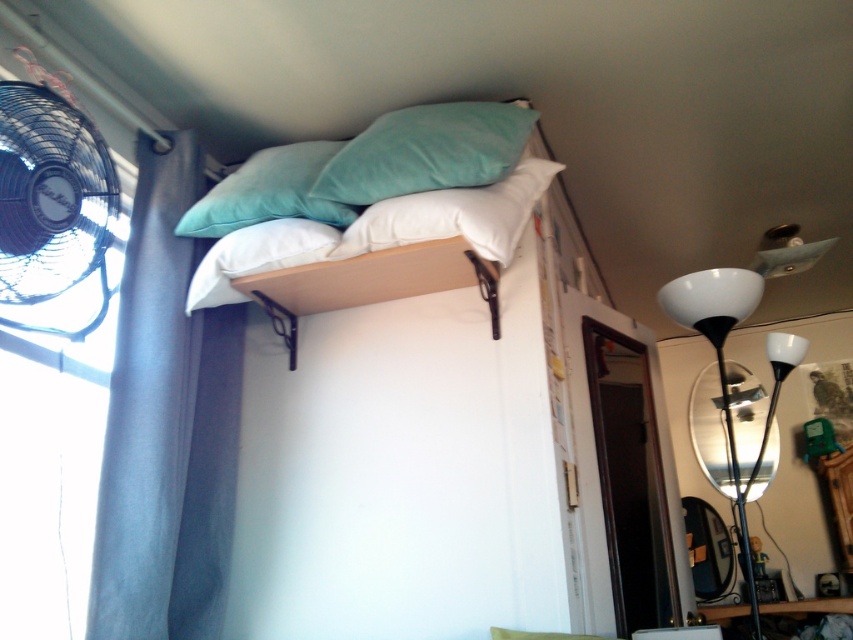
You are standing in the room and want to move the black plastic fan at left to the center of the room. Which direction should you move it from its current position?

The black plastic fan at left is currently located at point (51, 211). To move it to the center of the room, you should move it towards the right and upward.

You are trying to determine the best way to arrange your pillows for a comfortable sleep. If you want to ensure the white soft pillow at center is visible, should you move the teal velvety pillow at upper center or leave it as is?

The teal velvety pillow at upper center is currently in front of the white soft pillow at center. To make the white soft pillow at center visible, you need to move the teal velvety pillow at upper center out of the way.

You are in a small room with a bed mounted on the wall. You notice a point at coordinates (426, 150). What object is located at this point?

The point at coordinates (426, 150) corresponds to the teal velvety pillow at upper center.